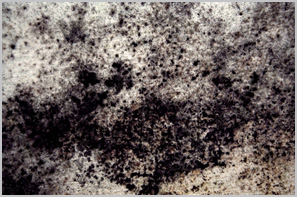
Where is `thin gray frame`? The width and height of the screenshot is (297, 197). thin gray frame is located at coordinates (163, 195).